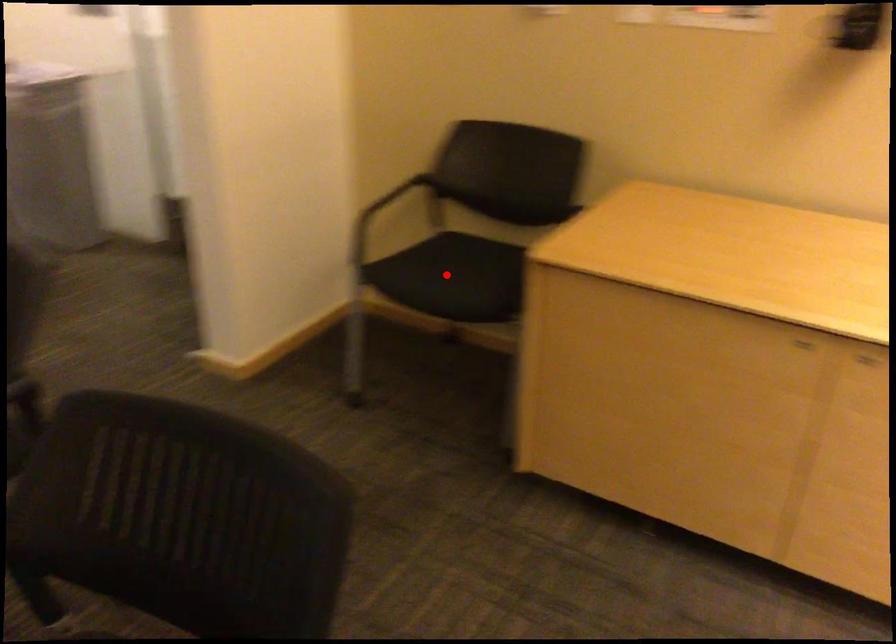
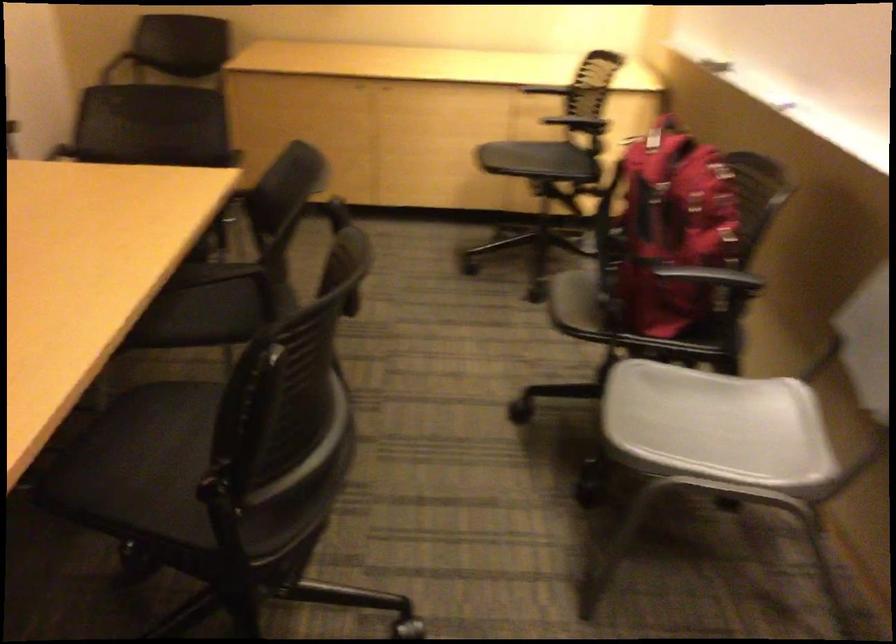
Question: I am providing you with two images of the same scene from different viewpoints. A red point is marked on the first image. At the location where the point appears in image 1, is it still visible in image 2?

Choices:
 (A) Yes
 (B) No

Answer: (B)